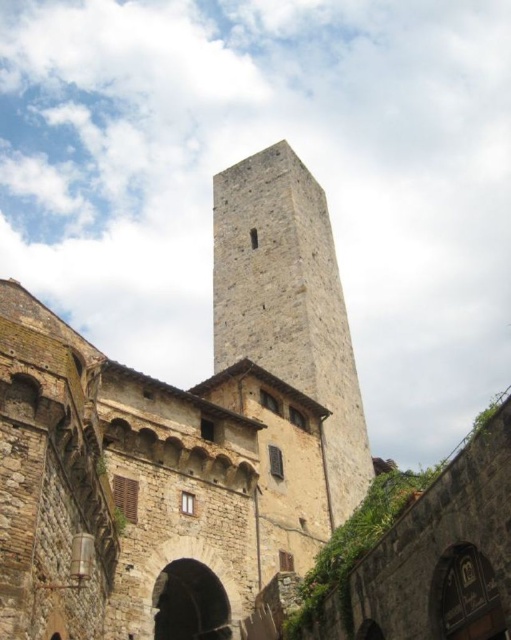
Is stone tower at center to the right of gray stone tower at center from the viewer's perspective?

In fact, stone tower at center is to the left of gray stone tower at center.

At what (x,y) coordinates should I click in order to perform the action: click on stone tower at center. Please return your answer as a coordinate pair (x, y). Looking at the image, I should click on (185, 433).